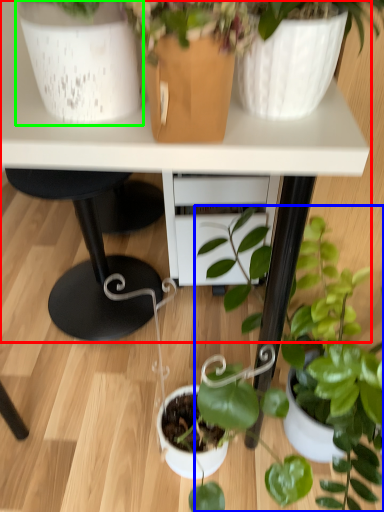
Question: Which object is positioned farthest from table (highlighted by a red box)? Select from houseplant (highlighted by a blue box) and flowerpot (highlighted by a green box).

Choices:
 (A) houseplant
 (B) flowerpot

Answer: (A)